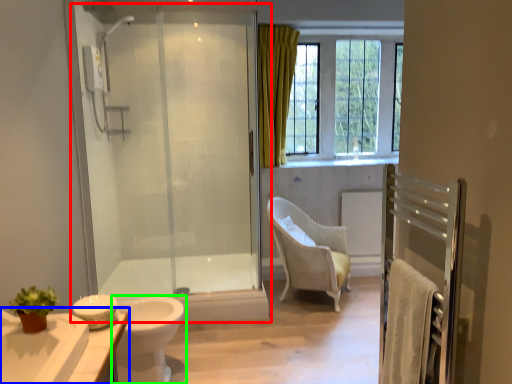
Question: Which is nearer to the screen door (highlighted by a red box)? bathroom cabinet (highlighted by a blue box) or toilet (highlighted by a green box).

Choices:
 (A) bathroom cabinet
 (B) toilet

Answer: (B)